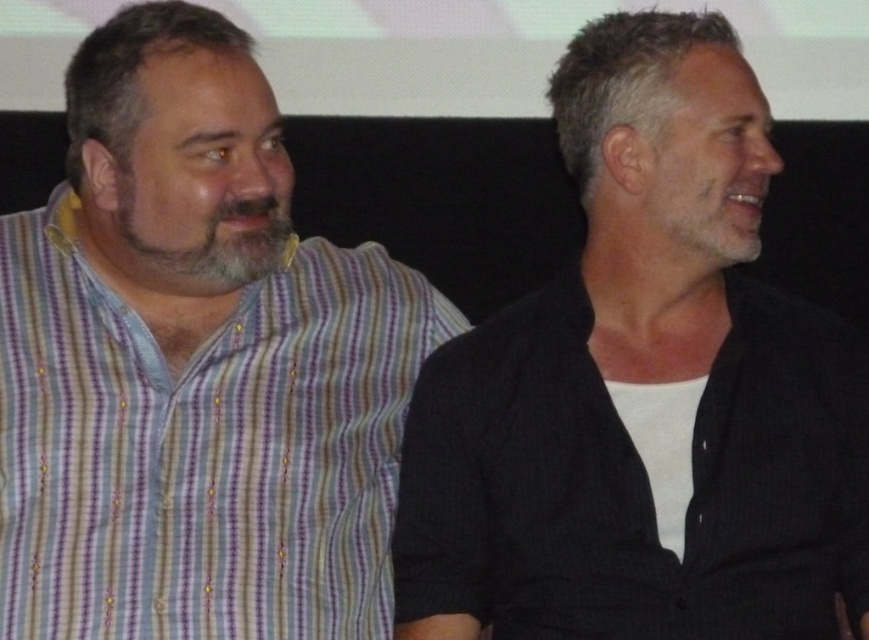
You are a photographer adjusting the focus on a camera. You need to focus on the dark gray textured shirt at center. What are the coordinates to set the focus point?

The coordinates to set the focus point on the dark gray textured shirt at center are (x=642, y=390).

You are standing in front of the image and want to touch the two points mentioned. Which point do you need to reach out further to touch, point (627,444) or point (109,326)?

You need to reach out further to touch point (109,326) because it is farther from the viewer compared to point (627,444).

You are a photographer standing 1.5 meters away from the dark gray textured shirt at center. Can you move closer to take a photo without exceeding the minimum safe distance of 1 meter?

The dark gray textured shirt at center is currently 1.19 meters away from the camera. Since you are standing 1.5 meters away, you can move 0.31 meters closer to reach the minimum safe distance of 1 meter without exceeding it.